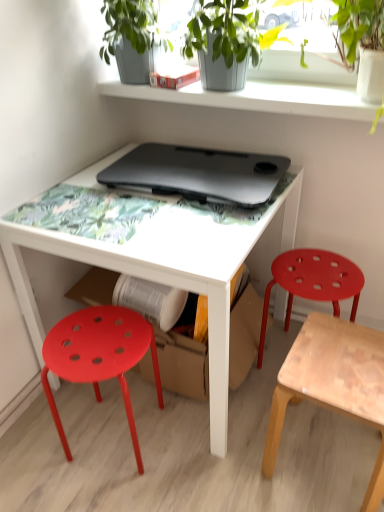
Identify the location of free spot above black matte laptop at center (from a real-world perspective). The width and height of the screenshot is (384, 512). (187, 170).